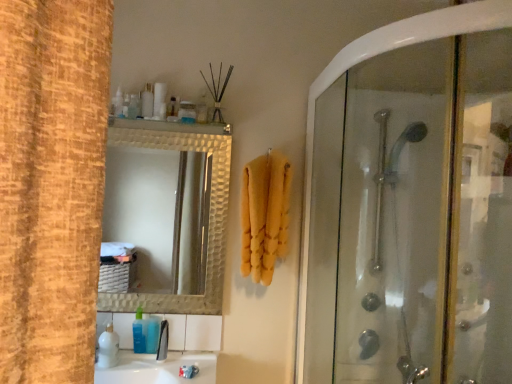
Question: From the image's perspective, is transparent glass shower door at right positioned above or below black plastic faucet at lower center?

Choices:
 (A) above
 (B) below

Answer: (A)

Question: Based on their positions, is transparent glass shower door at right located to the left or right of black plastic faucet at lower center?

Choices:
 (A) left
 (B) right

Answer: (B)

Question: Estimate the real-world distances between objects in this image. Which object is closer to the white glossy soap at upper center, the 1th toiletry viewed from the right?

Choices:
 (A) blue translucent soap at lower center, the 2th toiletry viewed from the right
 (B) white glossy sink at lower center
 (C) black plastic faucet at lower center
 (D) transparent glass shower door at right
 (E) yellow fluffy towel at center

Answer: (E)

Question: Which object is positioned closest to the black plastic faucet at lower center?

Choices:
 (A) transparent glass shower door at right
 (B) blue translucent soap at lower center, positioned as the first toiletry in bottom-to-top order
 (C) yellow fluffy towel at center
 (D) white glossy sink at lower center
 (E) white glossy soap at upper center, the 1th toiletry viewed from the right

Answer: (B)